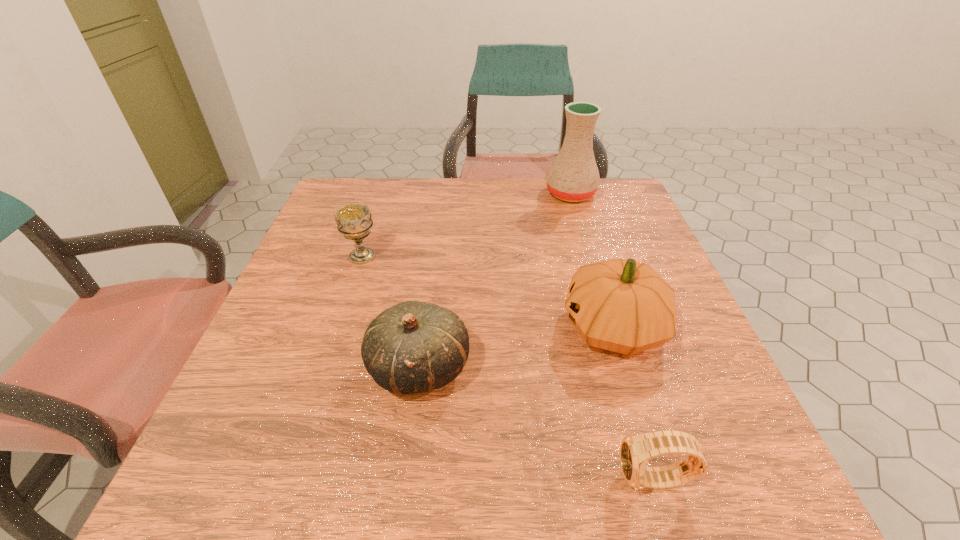
Where is `vacant space at the right edge of the desktop`? This screenshot has height=540, width=960. vacant space at the right edge of the desktop is located at coordinates (623, 253).

The width and height of the screenshot is (960, 540). In the image, there is a desktop. Identify the location of vacant space at the far left corner. (336, 195).

Identify the location of vacant space at the far right corner of the desktop. (612, 201).

This screenshot has height=540, width=960. Identify the location of unoccupied position between the farthest object and the left gourd. (495, 281).

The height and width of the screenshot is (540, 960). I want to click on vacant space that's between the shorter gourd and the pottery, so click(x=495, y=281).

You are a GUI agent. You are given a task and a screenshot of the screen. Output one action in this format:
    pyautogui.click(x=<x>, y=<y>)
    Task: Click on the vacant region between the left gourd and the right gourd
    
    Given the screenshot: What is the action you would take?
    pyautogui.click(x=516, y=348)

Identify the location of free space between the chalice and the watch. (509, 368).

In order to click on unoccupied area between the farthest object and the fourth object from right to left in this screenshot , I will do `click(495, 281)`.

Locate an element on the screen. The image size is (960, 540). free space that is in between the taller gourd and the tallest object is located at coordinates (592, 261).

Image resolution: width=960 pixels, height=540 pixels. Find the location of `object that is the nearest to the fourth object from right to left`. object that is the nearest to the fourth object from right to left is located at coordinates (624, 306).